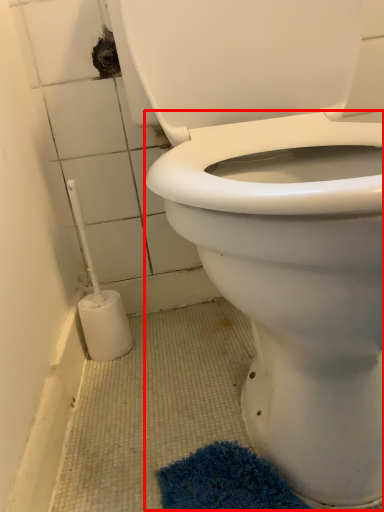
Question: From the image's perspective, what is the correct spatial relationship of bidet (annotated by the red box) in relation to brush?

Choices:
 (A) below
 (B) above

Answer: (B)